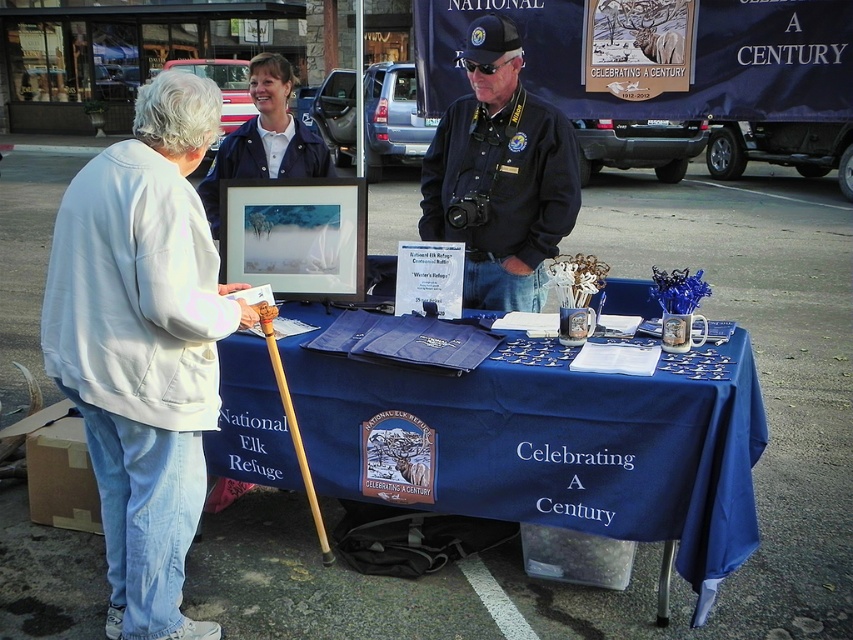
Question: Which point appears farthest from the camera in this image?

Choices:
 (A) (74, 228)
 (B) (434, 236)

Answer: (B)

Question: Does blue fabric table at center have a lesser width compared to white cotton jacket at left?

Choices:
 (A) yes
 (B) no

Answer: (B)

Question: Is blue fabric table at center behind white cotton jacket at left?

Choices:
 (A) no
 (B) yes

Answer: (B)

Question: Which of the following is the closest to the observer?

Choices:
 (A) (523, 237)
 (B) (341, 449)

Answer: (B)

Question: In this image, where is blue fabric table at center located relative to dark blue uniform at center?

Choices:
 (A) below
 (B) above

Answer: (A)

Question: Which object is the farthest from the white cotton jacket at left?

Choices:
 (A) dark blue uniform at center
 (B) blue fabric table at center

Answer: (A)